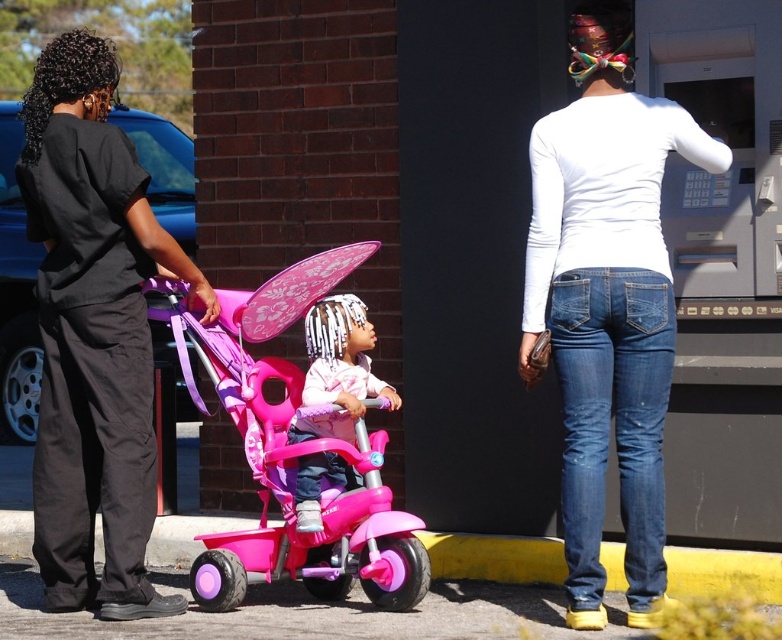
Looking at this image, you are a delivery person who needs to place a small package between the white matte shirt at center and the pink plastic tricycle at center. Can you fit the package in the space between them if the package requires 3 feet of space?

The white matte shirt at center and the pink plastic tricycle at center are 3.31 feet apart from each other. Since the required space is 3 feet, the package can fit between them.

You are a delivery person who needs to park your 1.8 meters tall delivery cart between the pink plastic tricycle at center and the matte pink tricycle at center. Can you fit your cart in the space between them?

The pink plastic tricycle at center is taller than the matte pink tricycle at center, so the space between them may not accommodate your 1.8 meters tall delivery cart. You should check the exact height difference to ensure clearance.

You are a delivery robot that needs to navigate between the black fabric shirt at left and the pink plastic tricycle at center. Based on their heights, which object should you avoid hitting to ensure safe passage?

The black fabric shirt at left has a greater height compared to the pink plastic tricycle at center. Therefore, you should avoid hitting the black fabric shirt at left to ensure safe passage since it is taller and might obstruct the robot more.